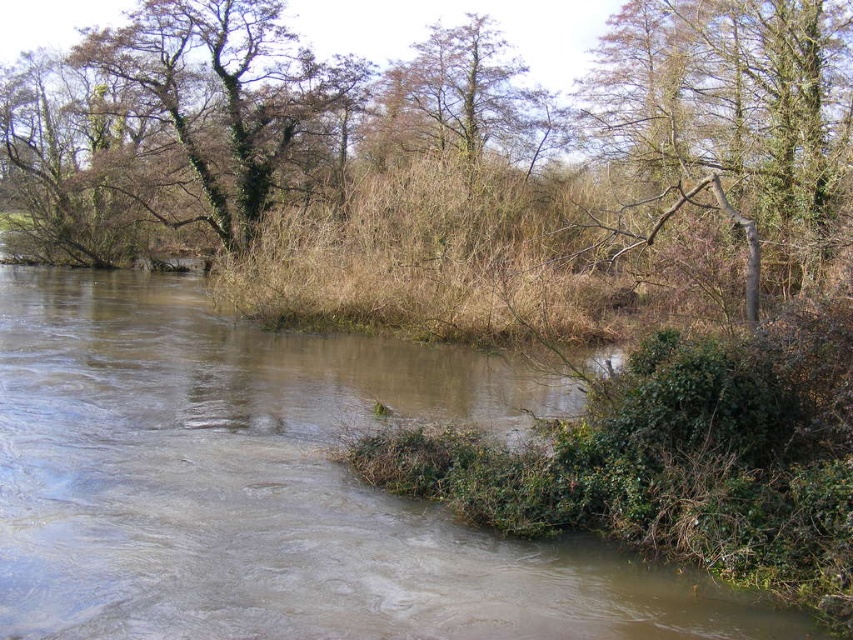
Is brown muddy river at center to the right of green leafy tree at upper left from the viewer's perspective?

Correct, you'll find brown muddy river at center to the right of green leafy tree at upper left.

Where is `brown muddy river at center`? Image resolution: width=853 pixels, height=640 pixels. brown muddy river at center is located at coordinates (277, 486).

Based on the photo, between brown muddy river at center and brown rough tree at upper right, which one appears on the left side from the viewer's perspective?

Positioned to the left is brown muddy river at center.

The width and height of the screenshot is (853, 640). What do you see at coordinates (277, 486) in the screenshot? I see `brown muddy river at center` at bounding box center [277, 486].

Between point (679, 608) and point (846, 76), which one is positioned behind?

Point (846, 76)

What are the coordinates of `brown muddy river at center` in the screenshot? It's located at (277, 486).

Is brown leafy tree at upper center in front of green leafy tree at upper left?

Yes.

Is point (752, 97) in front of point (161, 13)?

Yes, point (752, 97) is in front of point (161, 13).

The width and height of the screenshot is (853, 640). I want to click on brown leafy tree at upper center, so click(729, 97).